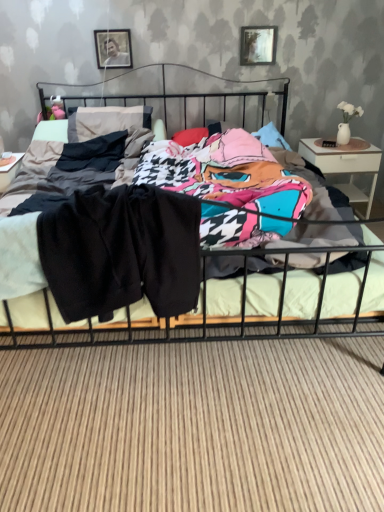
Question: Looking at their shapes, would you say metallic silver picture frame at upper center, which is the first picture frame in right-to-left order, is wider or thinner than metallic black bed at center?

Choices:
 (A) wide
 (B) thin

Answer: (B)

Question: Relative to metallic black bed at center, is metallic silver picture frame at upper center, which is the first picture frame in right-to-left order, in front or behind?

Choices:
 (A) behind
 (B) front

Answer: (A)

Question: Which of these objects is positioned farthest from the metallic black bed at center?

Choices:
 (A) metallic silver picture frame at upper center, which ranks as the second picture frame in right-to-left order
 (B) metallic silver picture frame at upper center, which is the first picture frame in right-to-left order
 (C) white glossy nightstand at right
 (D) black cotton pants at center

Answer: (A)

Question: Which object is positioned farthest from the metallic silver picture frame at upper center, which ranks as the second picture frame in right-to-left order?

Choices:
 (A) metallic silver picture frame at upper center, the 2th picture frame in the left-to-right sequence
 (B) white glossy nightstand at right
 (C) metallic black bed at center
 (D) black cotton pants at center

Answer: (D)